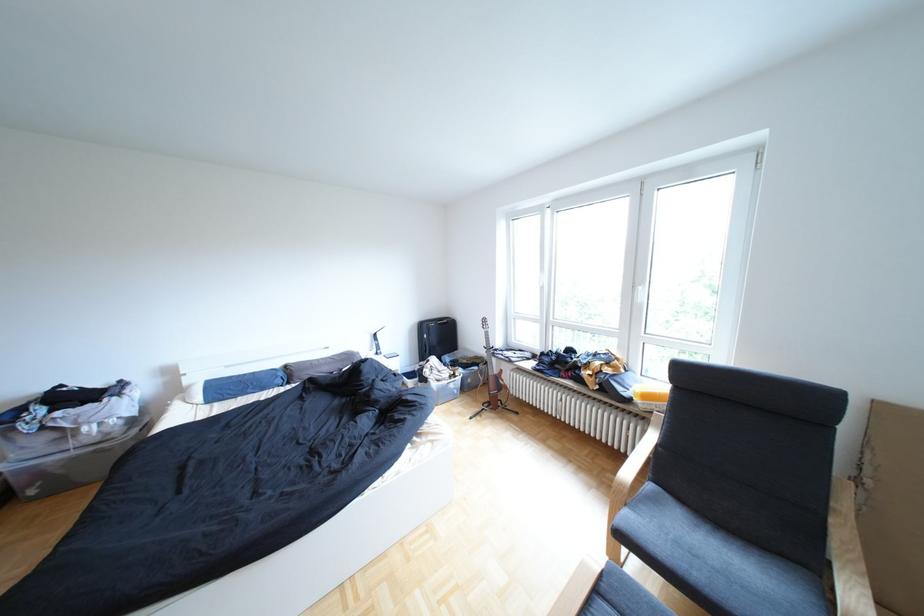
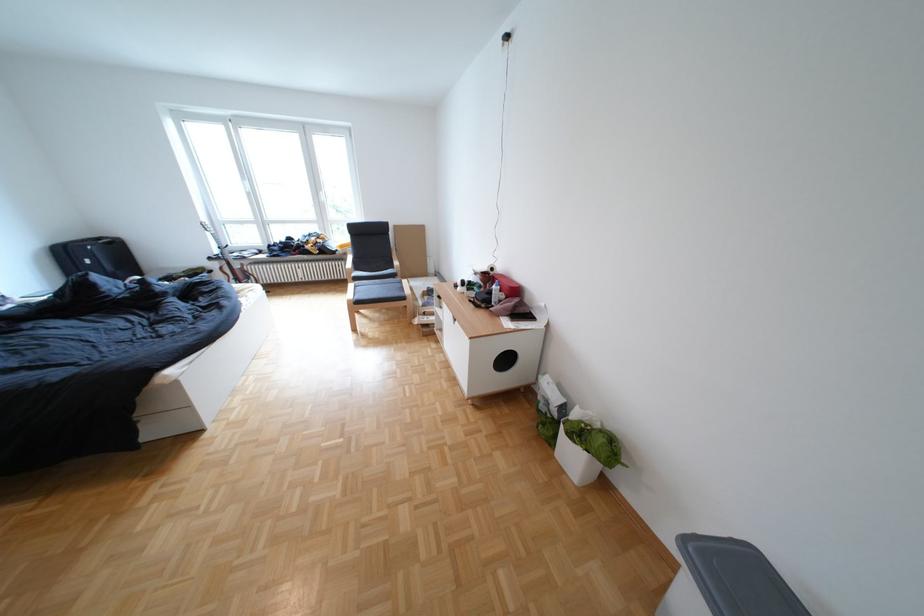
Find the pixel in the second image that matches the point at 460,323 in the first image.

(126, 244)